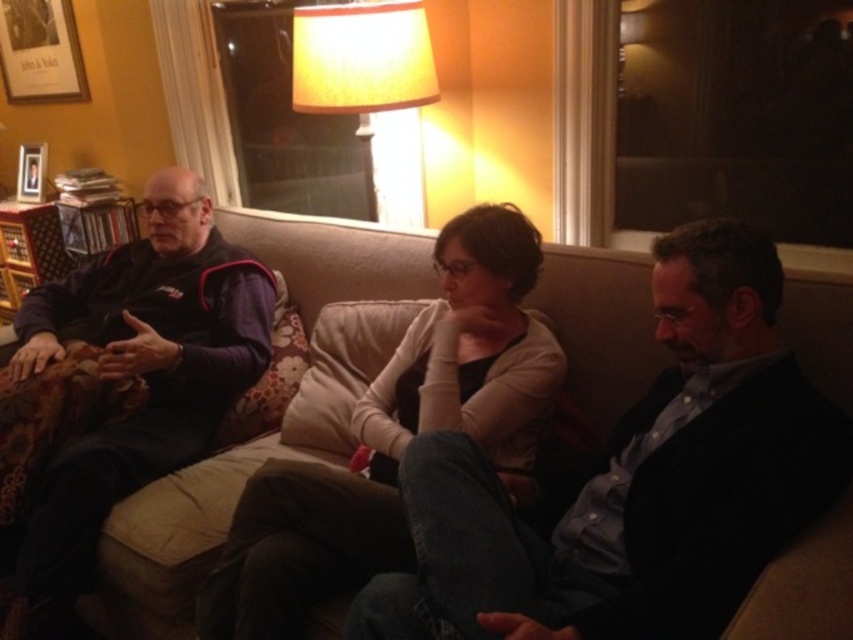
Looking at this image, you are standing in the living room and want to place a small potted plant between the two points marked as point (358, 232) and point (74, 525). Since the plant needs to be placed in front of the point that is further back, which point should you place it in front of?

Point (358, 232) is behind point (74, 525), so you should place the plant in front of point (358, 232).

You are standing in the living room and want to hand a gift to the person wearing the dark blue fleece jacket at left. The wooden picture frame at upper left is blocking your path. Can you walk around it to reach the jacket?

The dark blue fleece jacket at left is closer to the viewer than the wooden picture frame at upper left, so you can walk around the wooden picture frame at upper left to reach the dark blue fleece jacket at left.

You are sitting on the floor in front of the beige fabric couch at center and the light beige couch cushion at center. Which object is closer to you?

The light beige couch cushion at center is closer to you because it is positioned behind the beige fabric couch at center, which is closer to you.